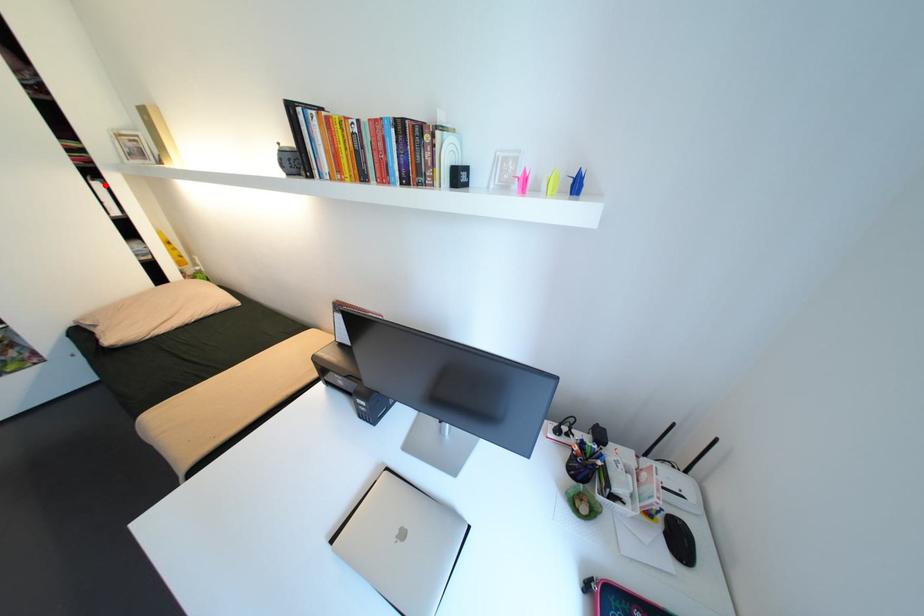
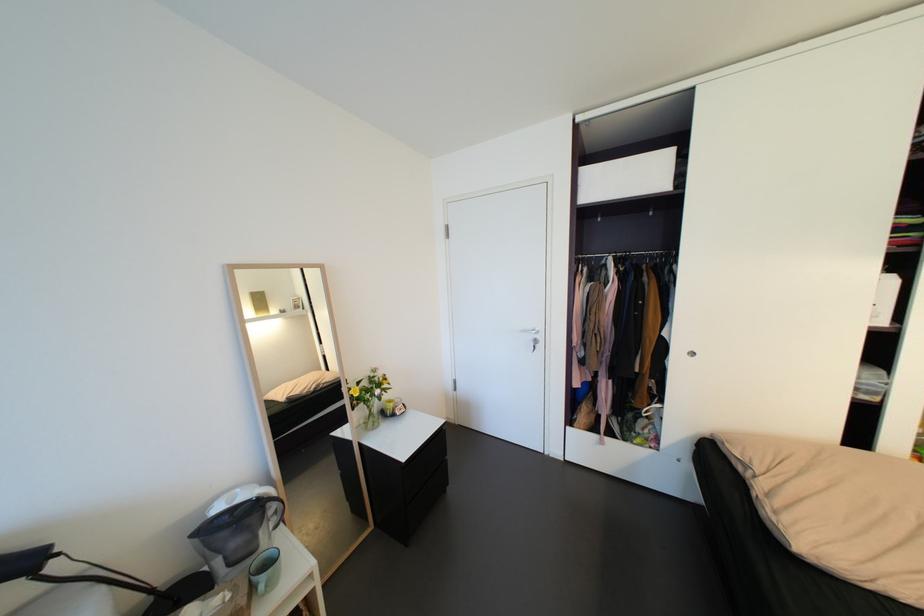
In the second image, find the point that corresponds to the highlighted location in the first image.

(900, 278)